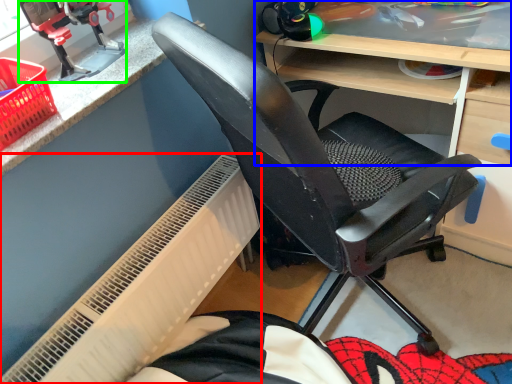
Question: Which object is the farthest from radiator (highlighted by a red box)? Choose among these: desk (highlighted by a blue box) or sport equipment (highlighted by a green box).

Choices:
 (A) desk
 (B) sport equipment

Answer: (A)